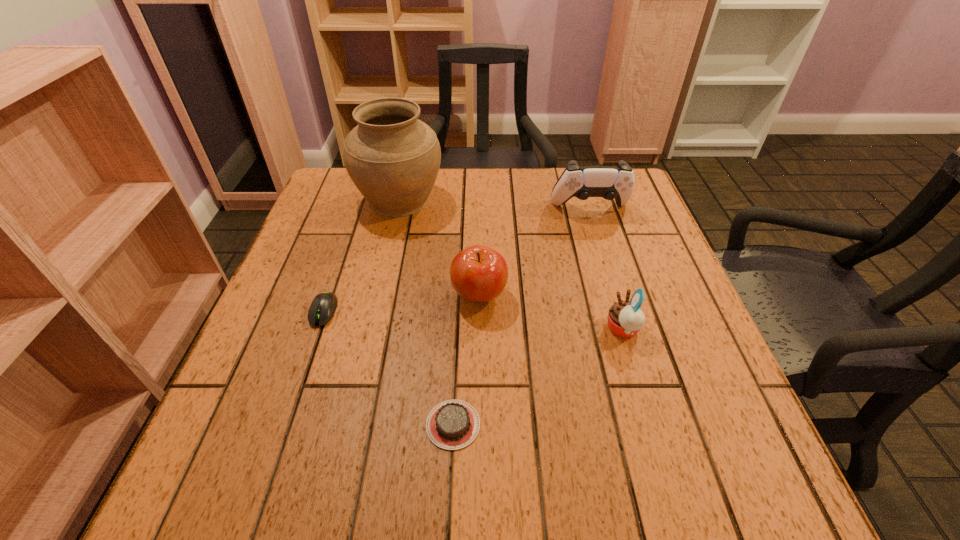
You are a GUI agent. You are given a task and a screenshot of the screen. Output one action in this format:
    pyautogui.click(x=<x>, y=<y>)
    Task: Click on the free area in between the computer mouse and the muffin
    The image size is (960, 540).
    Given the screenshot: What is the action you would take?
    pyautogui.click(x=473, y=320)

In order to click on free point between the apple and the nearest object in this screenshot , I will do `click(467, 360)`.

At what (x,y) coordinates should I click in order to perform the action: click on free space between the muffin and the urn. Please return your answer as a coordinate pair (x, y). The height and width of the screenshot is (540, 960). Looking at the image, I should click on (512, 265).

You are a GUI agent. You are given a task and a screenshot of the screen. Output one action in this format:
    pyautogui.click(x=<x>, y=<y>)
    Task: Click on the free point between the muffin and the apple
    This screenshot has height=540, width=960.
    Given the screenshot: What is the action you would take?
    point(551,312)

Where is `unoccupied area between the urn and the apple`? unoccupied area between the urn and the apple is located at coordinates (440, 248).

At what (x,y) coordinates should I click in order to perform the action: click on blank region between the second shortest object and the muffin. Please return your answer as a coordinate pair (x, y). The image size is (960, 540). Looking at the image, I should click on (473, 320).

Where is `free space between the fifth tallest object and the urn`? free space between the fifth tallest object and the urn is located at coordinates (362, 255).

At what (x,y) coordinates should I click in order to perform the action: click on free spot between the apple and the tallest object. Please return your answer as a coordinate pair (x, y). Image resolution: width=960 pixels, height=540 pixels. Looking at the image, I should click on (440, 248).

At what (x,y) coordinates should I click in order to perform the action: click on free point between the nearest object and the control. Please return your answer as a coordinate pair (x, y). This screenshot has width=960, height=540. Looking at the image, I should click on (521, 317).

At what (x,y) coordinates should I click in order to perform the action: click on vacant space that's between the control and the apple. Please return your answer as a coordinate pair (x, y). This screenshot has height=540, width=960. Looking at the image, I should click on (535, 252).